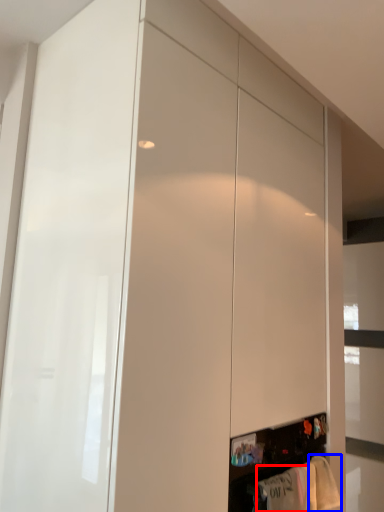
Question: Among these objects, which one is nearest to the camera, clothing (highlighted by a red box) or clothing (highlighted by a blue box)?

Choices:
 (A) clothing
 (B) clothing

Answer: (A)